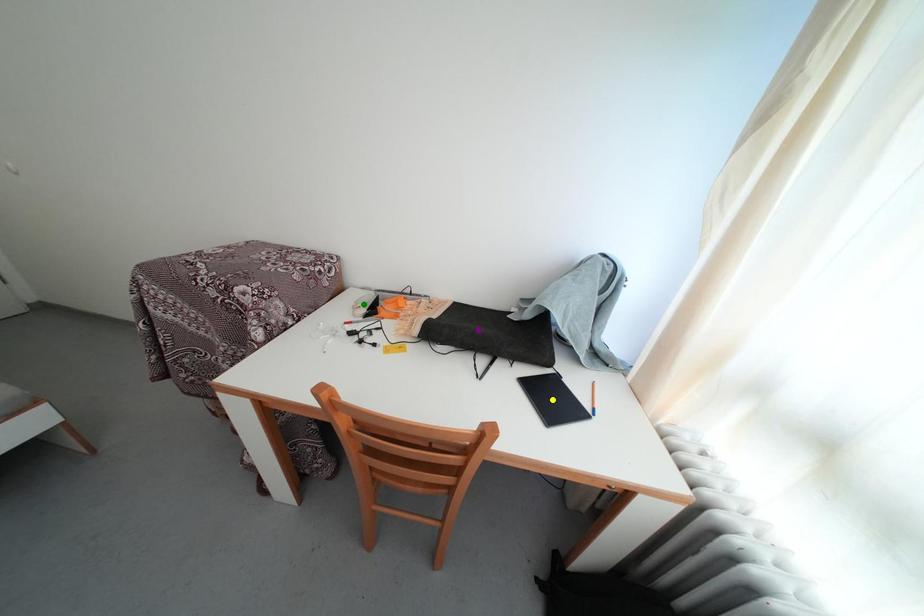
Order these from nearest to farthest:
1. yellow point
2. purple point
3. green point

yellow point < green point < purple point